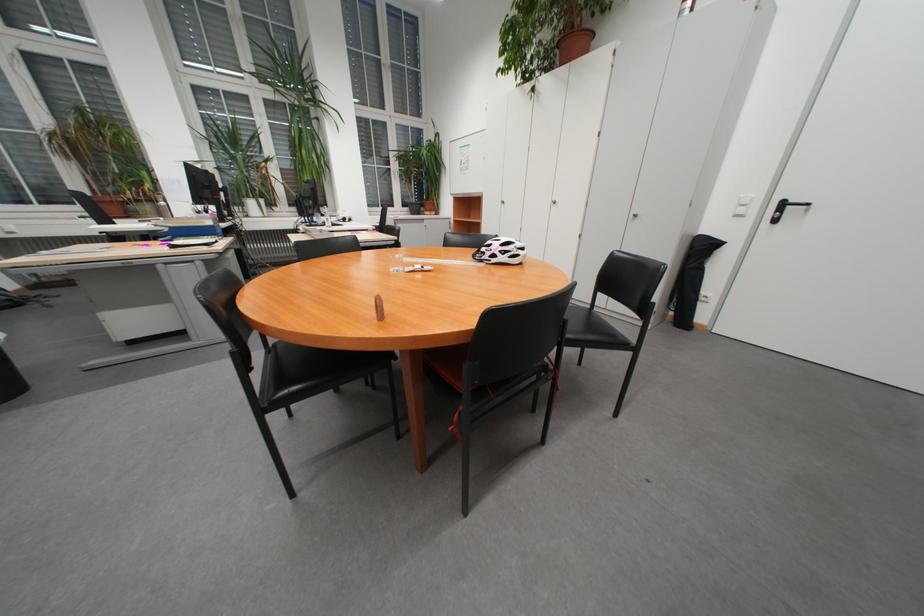
Where would you push the white light switch? Please return your answer as a coordinate pair (x, y).

(742, 206)